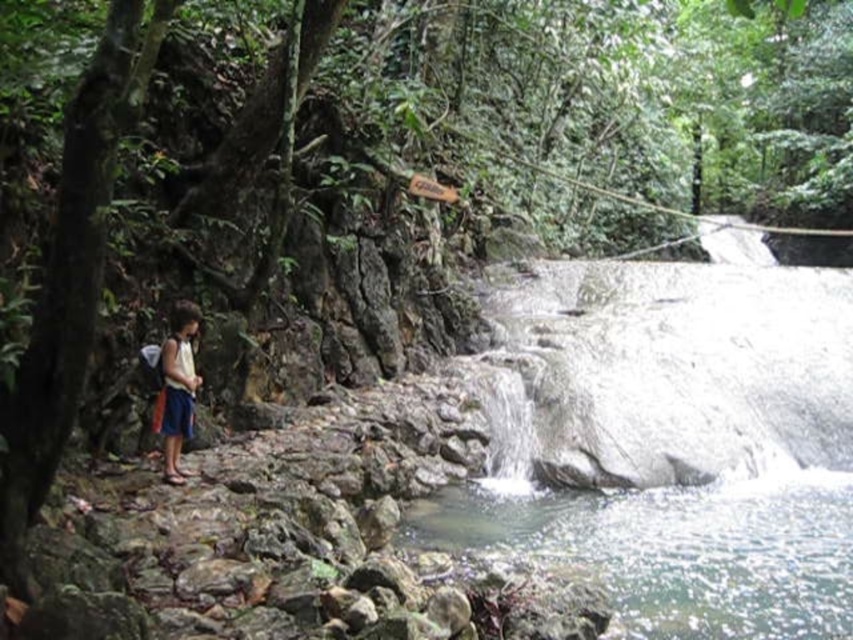
Between point (456, 484) and point (178, 323), which one is positioned behind?

Point (456, 484)

Does clear water at center have a greater height compared to blue denim shorts at left?

Answer: No, clear water at center is not taller than blue denim shorts at left.

Between point (654, 506) and point (167, 420), which one is positioned in front?

Positioned in front is point (167, 420).

Where is `clear water at center`? This screenshot has width=853, height=640. clear water at center is located at coordinates (675, 548).